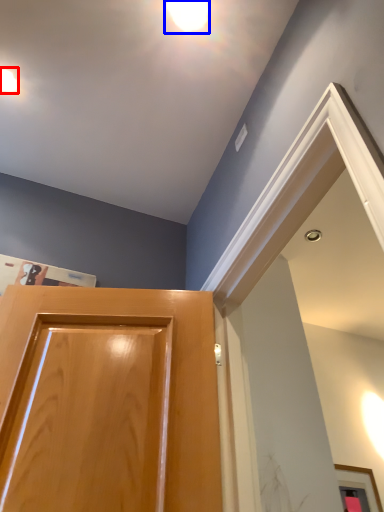
Question: Which object is further to the camera taking this photo, droplight (highlighted by a red box) or droplight (highlighted by a blue box)?

Choices:
 (A) droplight
 (B) droplight

Answer: (A)